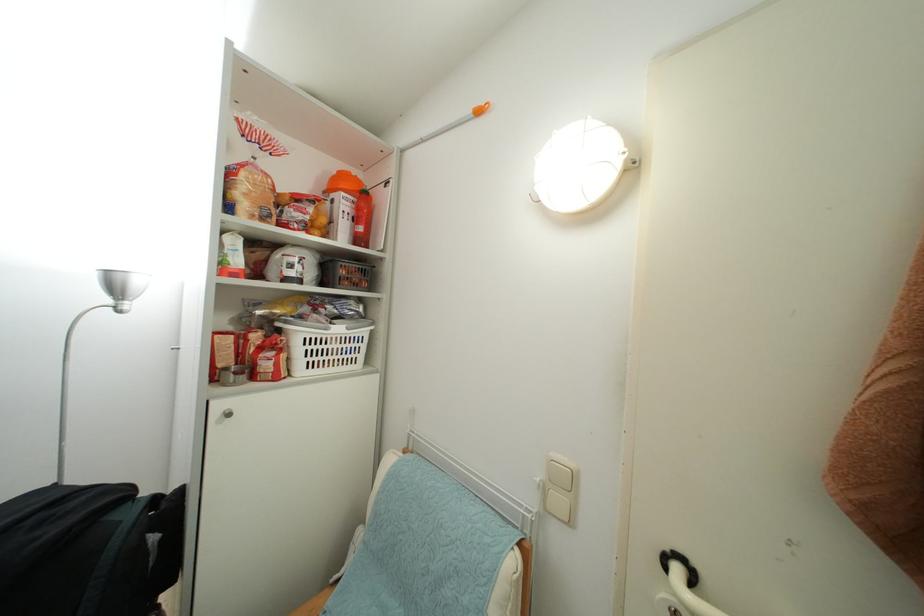
This screenshot has height=616, width=924. Identify the location of orange plastic colander. (344, 183).